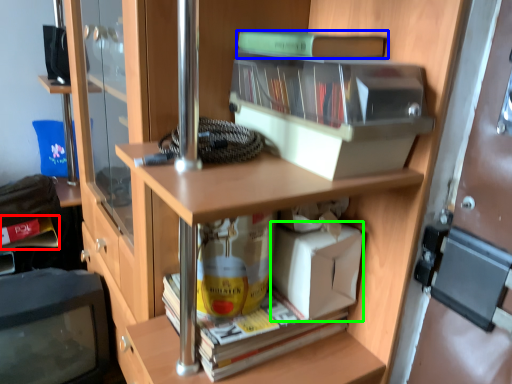
Question: Which object is the closest to the book (highlighted by a red box)? Choose among these: book (highlighted by a blue box) or box (highlighted by a green box).

Choices:
 (A) book
 (B) box

Answer: (B)